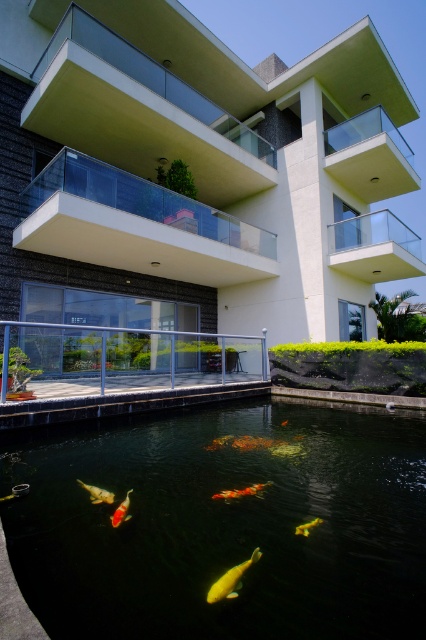
You are a visitor standing in front of the modern building and notice two fish in the pond. The yellow shiny fish at center and the shiny orange fish at lower center. Which fish is taller?

The yellow shiny fish at center is much taller than the shiny orange fish at lower center.

You are a visitor at the pond in front of the modern building. You see the yellow shiny fish at center and the shiny orange fish at lower center. Which fish is wider?

The yellow shiny fish at center is wider than the shiny orange fish at lower center because its width surpasses the latter.

You are an architect reviewing the building design. You need to determine which transparent glass balcony is shorter between the transparent glass balcony at upper center and the transparent glass balcony at upper right. Which one is shorter?

The transparent glass balcony at upper center is shorter than the transparent glass balcony at upper right.